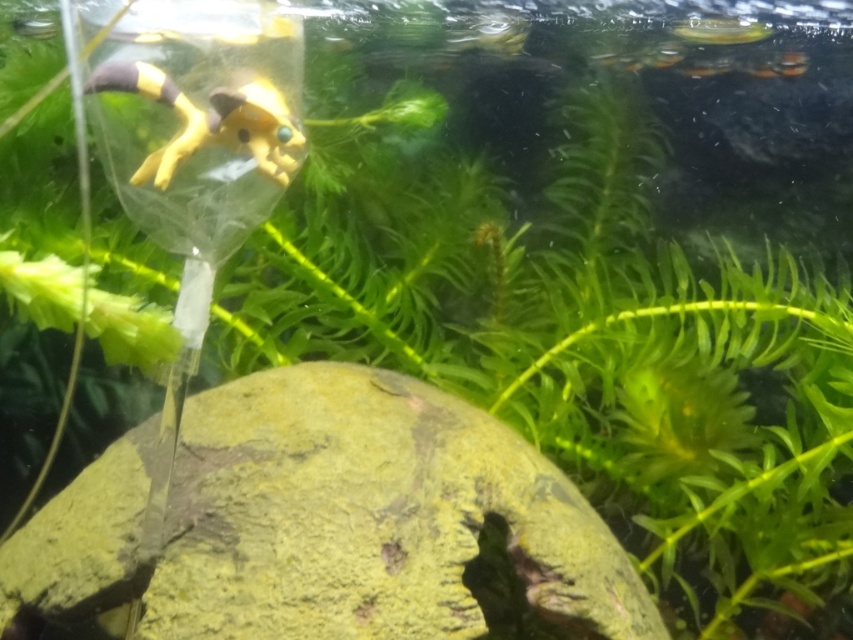
Which is below, yellow matte toy at upper left or translucent plastic fish at upper right?

yellow matte toy at upper left

Which is behind, point (265, 83) or point (757, 35)?

The point (757, 35) is more distant.

You are a GUI agent. You are given a task and a screenshot of the screen. Output one action in this format:
    pyautogui.click(x=<x>, y=<y>)
    Task: Click on the yellow matte toy at upper left
    
    Given the screenshot: What is the action you would take?
    pyautogui.click(x=209, y=120)

Between green mossy rock at center and translucent plastic fish at upper right, which one has more height?

Standing taller between the two is green mossy rock at center.

Is point (561, 531) farther from viewer compared to point (727, 19)?

No.

This screenshot has height=640, width=853. What do you see at coordinates (368, 516) in the screenshot?
I see `green mossy rock at center` at bounding box center [368, 516].

Where is `green mossy rock at center`? The width and height of the screenshot is (853, 640). green mossy rock at center is located at coordinates (368, 516).

Which is below, green mossy rock at center or yellow matte toy at upper left?

green mossy rock at center is below.

Can you confirm if green mossy rock at center is smaller than yellow matte toy at upper left?

Actually, green mossy rock at center might be larger than yellow matte toy at upper left.

Identify the location of green mossy rock at center. pos(368,516).

Where is `green mossy rock at center`? This screenshot has height=640, width=853. green mossy rock at center is located at coordinates (368, 516).